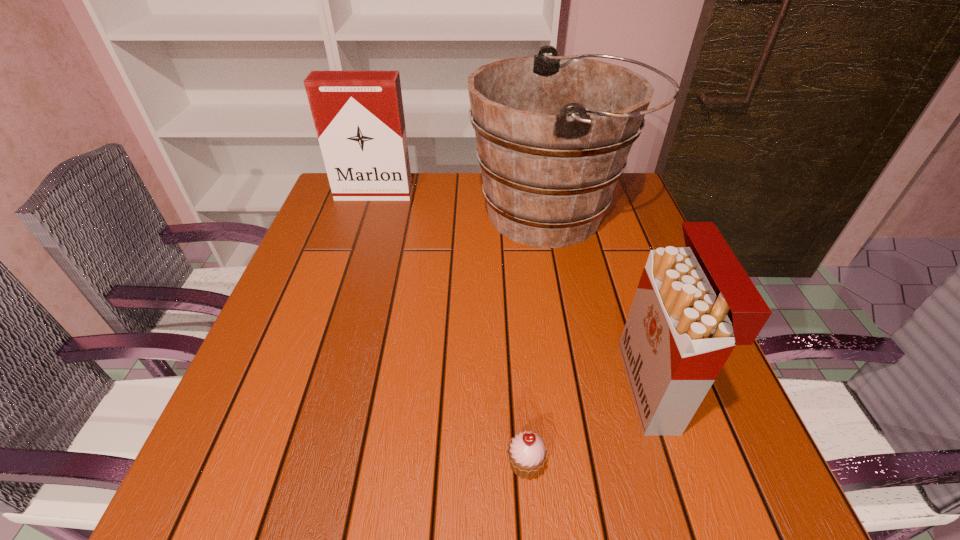
Find the location of a particular element. Image resolution: width=960 pixels, height=540 pixels. vacant space at the far edge of the desktop is located at coordinates (447, 203).

Identify the location of vacant space at the near edge of the desktop. The width and height of the screenshot is (960, 540). (505, 492).

The height and width of the screenshot is (540, 960). In the image, there is a desktop. Identify the location of free space at the left edge. (307, 299).

The image size is (960, 540). I want to click on free space at the far left corner of the desktop, so click(x=332, y=218).

Locate an element on the screen. The image size is (960, 540). blank space at the far right corner is located at coordinates (612, 211).

Where is `empty space that is in between the bucket and the nearest object`? empty space that is in between the bucket and the nearest object is located at coordinates (540, 339).

Find the location of a particular element. The height and width of the screenshot is (540, 960). free space between the bucket and the nearest object is located at coordinates (540, 339).

At what (x,y) coordinates should I click in order to perform the action: click on free point between the farther cigarette case and the right cigarette case. Please return your answer as a coordinate pair (x, y). The width and height of the screenshot is (960, 540). Looking at the image, I should click on (514, 291).

At what (x,y) coordinates should I click in order to perform the action: click on unoccupied position between the nearest object and the right cigarette case. Please return your answer as a coordinate pair (x, y). The image size is (960, 540). Looking at the image, I should click on (589, 426).

The width and height of the screenshot is (960, 540). I want to click on free space between the nearest object and the bucket, so click(x=540, y=339).